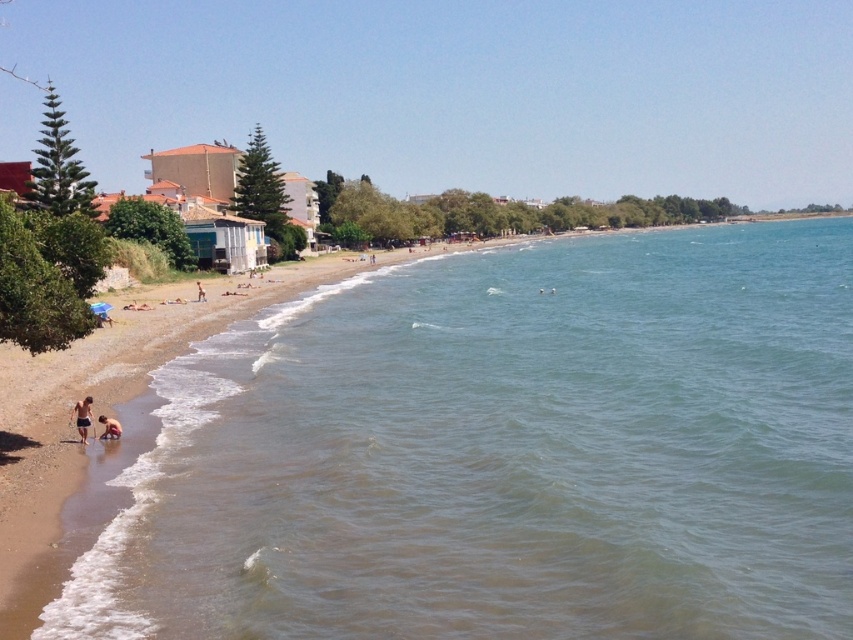
You are standing at the shoreline on the beach and want to walk to the point labeled point (76, 403). However, there is an obstacle at point labeled point (305, 460). Which point should you avoid stepping on to reach your destination safely?

You should avoid stepping on point (305, 460) because it is in front of point (76, 403), meaning it is closer to your current position at the shoreline and blocking the path.

You are standing at the shoreline looking out at the water. There are two points marked in the image. Which point, point (173, 524) or point (100, 417), is closer to you?

Point (173, 524) is closer to the viewer than point (100, 417).